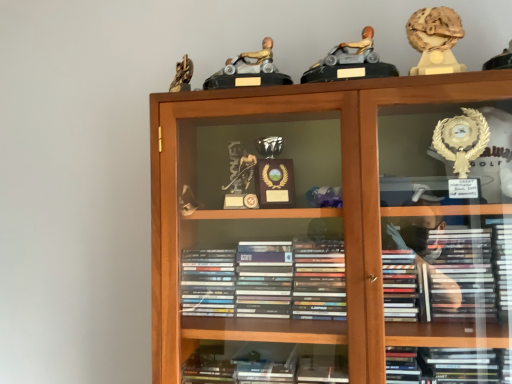
Question: Is matte gray plastic toy car at upper center, the second toy positioned from the right, positioned before wooden bookcase at center?

Choices:
 (A) no
 (B) yes

Answer: (A)

Question: Can you confirm if matte gray plastic toy car at upper center, the second toy in the left-to-right sequence, is shorter than wooden bookcase at center?

Choices:
 (A) no
 (B) yes

Answer: (B)

Question: Is matte gray plastic toy car at upper center, the second toy positioned from the right, wider than wooden bookcase at center?

Choices:
 (A) yes
 (B) no

Answer: (B)

Question: Is matte gray plastic toy car at upper center, the second toy positioned from the right, not close to wooden bookcase at center?

Choices:
 (A) no
 (B) yes

Answer: (A)

Question: Is matte gray plastic toy car at upper center, the second toy in the left-to-right sequence, thinner than wooden bookcase at center?

Choices:
 (A) yes
 (B) no

Answer: (A)

Question: Does matte gray plastic toy car at upper center, the second toy positioned from the right, have a larger size compared to wooden bookcase at center?

Choices:
 (A) yes
 (B) no

Answer: (B)

Question: Is gold marble statue at upper right, which is counted as the 1th toy, starting from the right, outside of wooden bookcase at center?

Choices:
 (A) no
 (B) yes

Answer: (B)

Question: From a real-world perspective, is gold marble statue at upper right, which is counted as the 1th toy, starting from the right, over wooden bookcase at center?

Choices:
 (A) no
 (B) yes

Answer: (B)

Question: Is gold marble statue at upper right, which is counted as the 1th toy, starting from the right, in front of wooden bookcase at center?

Choices:
 (A) no
 (B) yes

Answer: (A)

Question: Does gold marble statue at upper right, acting as the 3th toy starting from the left, have a lesser height compared to wooden bookcase at center?

Choices:
 (A) yes
 (B) no

Answer: (A)

Question: Is the depth of gold marble statue at upper right, acting as the 3th toy starting from the left, greater than that of wooden bookcase at center?

Choices:
 (A) yes
 (B) no

Answer: (A)

Question: From the image's perspective, would you say gold marble statue at upper right, acting as the 3th toy starting from the left, is shown under wooden bookcase at center?

Choices:
 (A) yes
 (B) no

Answer: (B)

Question: Is wooden bookcase at center at the left side of gold marble statue at upper right, acting as the 3th toy starting from the left?

Choices:
 (A) no
 (B) yes

Answer: (B)